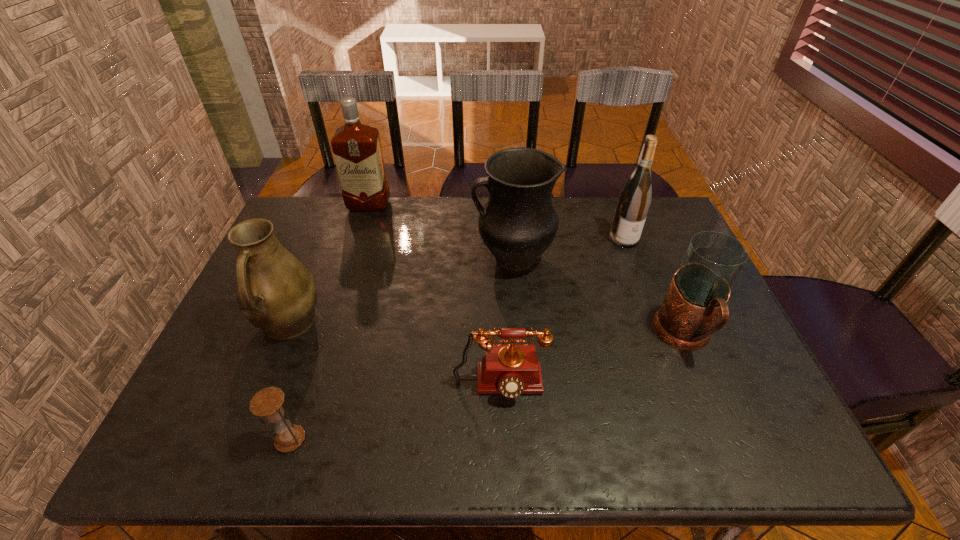
The image size is (960, 540). I want to click on object that is at the left edge, so click(x=275, y=292).

Where is `wine bottle that is at the right edge`? The width and height of the screenshot is (960, 540). wine bottle that is at the right edge is located at coordinates (634, 200).

You are a GUI agent. You are given a task and a screenshot of the screen. Output one action in this format:
    pyautogui.click(x=<x>, y=<y>)
    Task: Click on the pitcher that is positioned at the right edge
    
    Given the screenshot: What is the action you would take?
    pyautogui.click(x=699, y=291)

I want to click on object at the far right corner, so [634, 200].

Identify the location of free region at the far edge of the desktop. Image resolution: width=960 pixels, height=540 pixels. click(431, 201).

This screenshot has height=540, width=960. Find the location of `free space at the near edge`. free space at the near edge is located at coordinates (669, 433).

Where is `blank area at the left edge`? This screenshot has width=960, height=540. blank area at the left edge is located at coordinates (241, 413).

In order to click on vacant space at the right edge of the desktop in this screenshot , I will do `click(670, 242)`.

At what (x,y) coordinates should I click in order to perform the action: click on blank space at the near right corner. Please return your answer as a coordinate pair (x, y). Image resolution: width=960 pixels, height=540 pixels. Looking at the image, I should click on (792, 433).

Find the location of `empty location between the telephone and the liquor`. empty location between the telephone and the liquor is located at coordinates (435, 296).